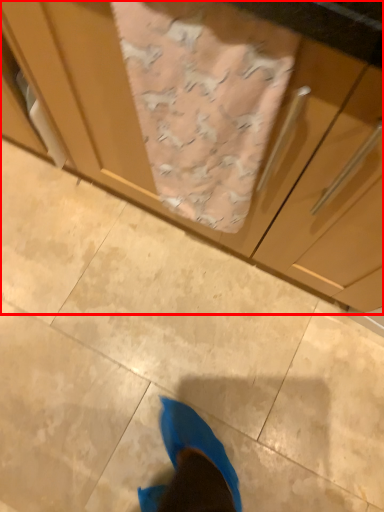
Question: Considering the relative positions of cabinetry (annotated by the red box) and blanket in the image provided, where is cabinetry (annotated by the red box) located with respect to the staircase?

Choices:
 (A) left
 (B) right

Answer: (A)